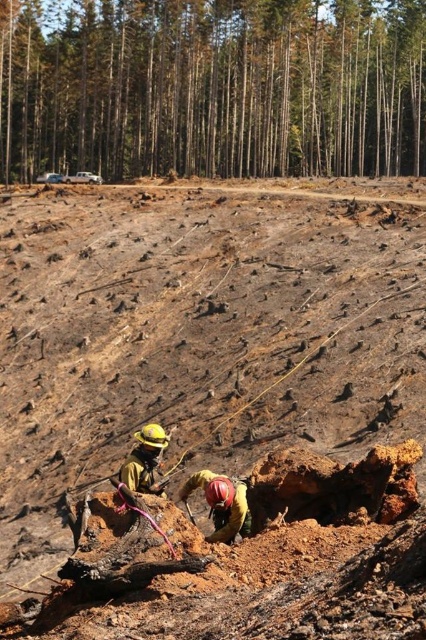
Question: Which object is the closest to the brown wood tree at upper center?

Choices:
 (A) hard hat helmet at center
 (B) yellow hard hat at lower left

Answer: (A)

Question: Can you confirm if brown wood tree at upper center is positioned above hard hat helmet at center?

Choices:
 (A) yes
 (B) no

Answer: (A)

Question: Is brown soil at center smaller than brown wood tree at upper center?

Choices:
 (A) no
 (B) yes

Answer: (B)

Question: Can you confirm if brown wood tree at upper center is positioned above hard hat helmet at center?

Choices:
 (A) yes
 (B) no

Answer: (A)

Question: Which point is farther to the camera?

Choices:
 (A) pos(143,458)
 (B) pos(26,26)
 (C) pos(43,525)
 (D) pos(227,486)

Answer: (B)

Question: Which point is closer to the camera?

Choices:
 (A) (43, 58)
 (B) (411, 352)

Answer: (B)